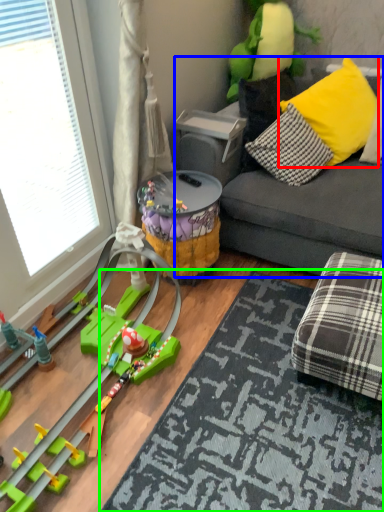
Question: Which object is the farthest from pillow (highlighted by a red box)? Choose among these: studio couch (highlighted by a blue box) or mat (highlighted by a green box).

Choices:
 (A) studio couch
 (B) mat

Answer: (B)